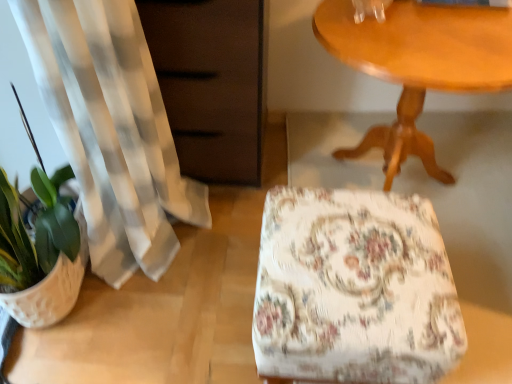
Question: Considering the relative sizes of matte brown dresser at left and wooden table at upper right in the image provided, is matte brown dresser at left bigger than wooden table at upper right?

Choices:
 (A) yes
 (B) no

Answer: (B)

Question: Considering the relative positions of matte brown dresser at left and wooden table at upper right in the image provided, is matte brown dresser at left to the left of wooden table at upper right from the viewer's perspective?

Choices:
 (A) no
 (B) yes

Answer: (B)

Question: Is matte brown dresser at left positioned with its back to wooden table at upper right?

Choices:
 (A) yes
 (B) no

Answer: (B)

Question: Is matte brown dresser at left positioned far away from wooden table at upper right?

Choices:
 (A) yes
 (B) no

Answer: (B)

Question: Is matte brown dresser at left completely or partially outside of wooden table at upper right?

Choices:
 (A) no
 (B) yes

Answer: (B)

Question: From a real-world perspective, does matte brown dresser at left sit lower than wooden table at upper right?

Choices:
 (A) yes
 (B) no

Answer: (B)

Question: Is wooden table at upper right located within white textured flowerpot at lower left?

Choices:
 (A) no
 (B) yes

Answer: (A)

Question: Is the surface of white textured flowerpot at lower left in direct contact with wooden table at upper right?

Choices:
 (A) yes
 (B) no

Answer: (B)

Question: Is white textured flowerpot at lower left turned away from wooden table at upper right?

Choices:
 (A) no
 (B) yes

Answer: (A)

Question: From the image's perspective, is white textured flowerpot at lower left located beneath wooden table at upper right?

Choices:
 (A) yes
 (B) no

Answer: (A)

Question: Does white textured flowerpot at lower left have a lesser width compared to wooden table at upper right?

Choices:
 (A) yes
 (B) no

Answer: (A)

Question: Is white textured flowerpot at lower left located outside wooden table at upper right?

Choices:
 (A) yes
 (B) no

Answer: (A)

Question: From a real-world perspective, is floral fabric ottoman at center located higher than matte brown dresser at left?

Choices:
 (A) no
 (B) yes

Answer: (A)